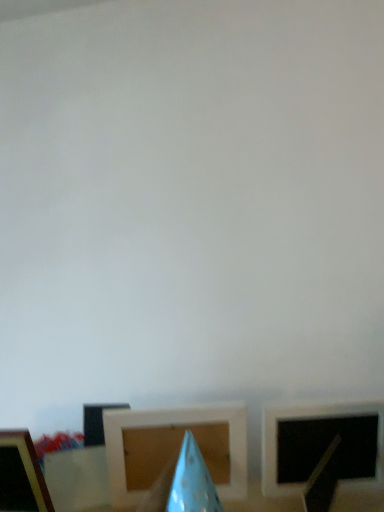
Question: Considering the positions of wooden at center, acting as the second picture frame starting from the right, and blue paper cone at center in the image, is wooden at center, acting as the second picture frame starting from the right, wider or thinner than blue paper cone at center?

Choices:
 (A) thin
 (B) wide

Answer: (B)

Question: From the image's perspective, is wooden at center, acting as the second picture frame starting from the right, above or below blue paper cone at center?

Choices:
 (A) above
 (B) below

Answer: (B)

Question: Which object is the farthest from the wooden picture frame at lower left, the 3th picture frame from the right?

Choices:
 (A) matte white picture frame at right, which is counted as the 3th picture frame, starting from the left
 (B) wooden at center, acting as the second picture frame starting from the right
 (C) blue paper cone at center

Answer: (A)

Question: Estimate the real-world distances between objects in this image. Which object is closer to the wooden at center, acting as the second picture frame starting from the right?

Choices:
 (A) blue paper cone at center
 (B) wooden picture frame at lower left, the 3th picture frame from the right
 (C) matte white picture frame at right, which is counted as the 3th picture frame, starting from the left

Answer: (A)